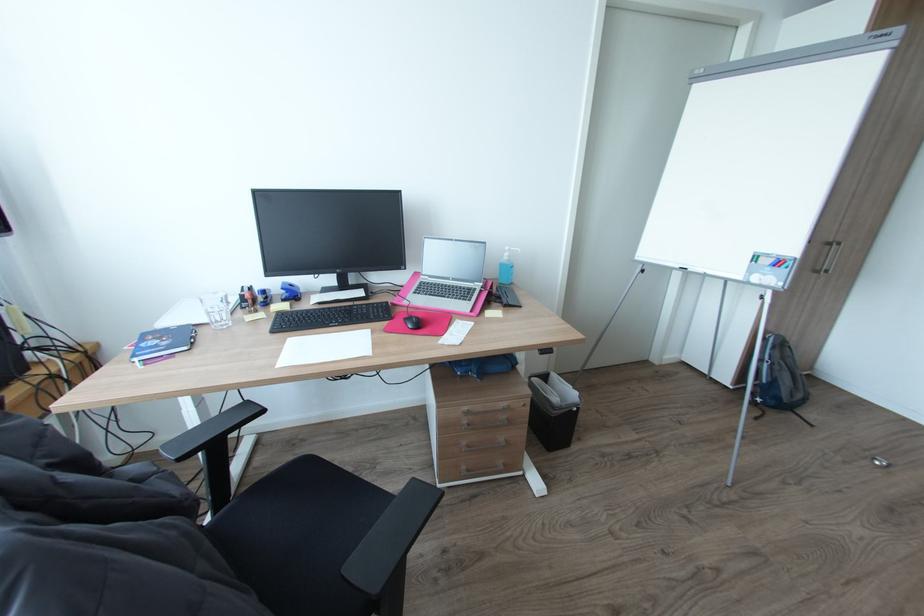
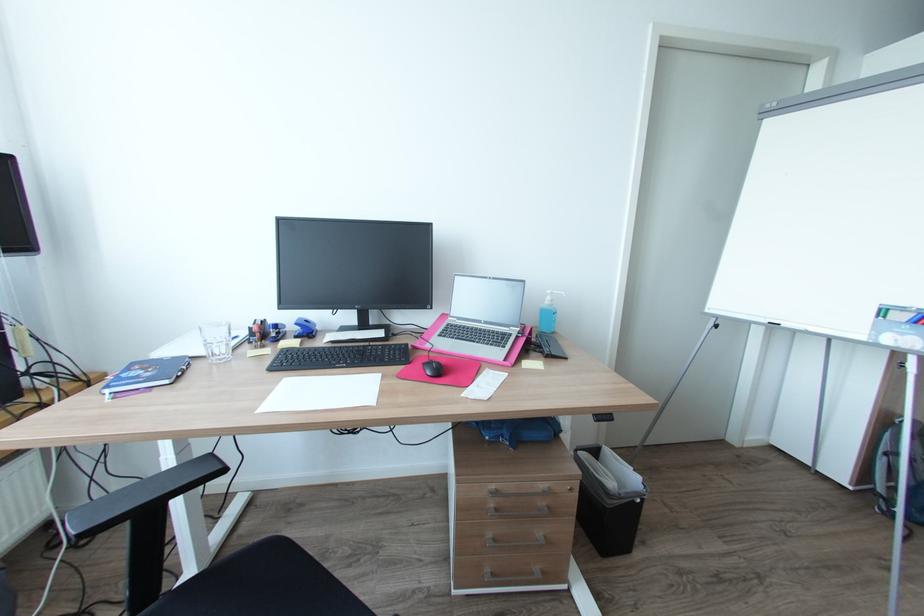
Locate, in the second image, the point that corresponds to (505,463) in the first image.

(541, 569)